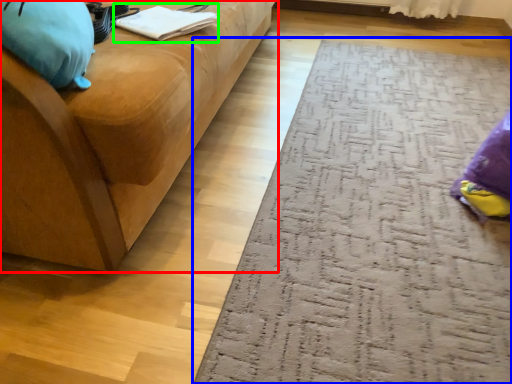
Question: Which object is positioned closest to studio couch (highlighted by a red box)? Select from doormat (highlighted by a blue box) and book (highlighted by a green box).

Choices:
 (A) doormat
 (B) book

Answer: (B)